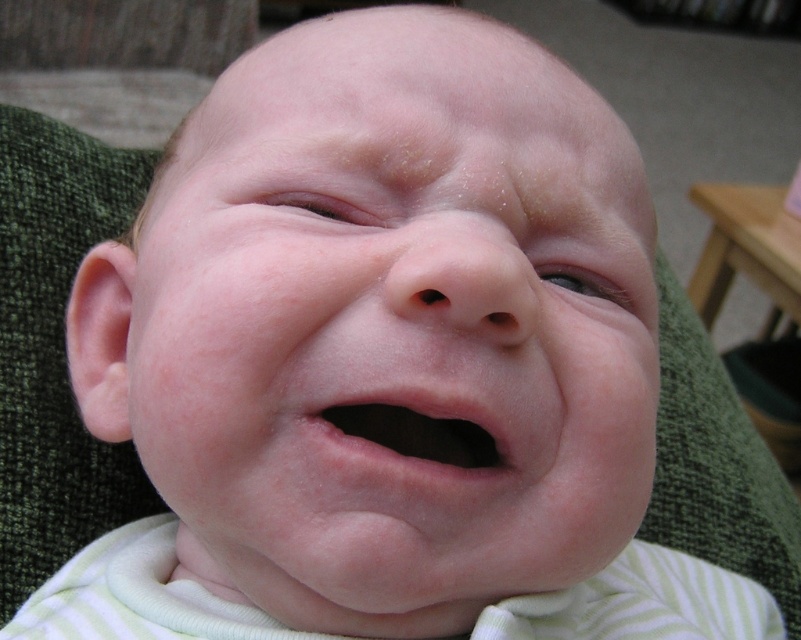
Does point (207, 221) come behind point (365, 438)?

That is True.

Which is more to the left, smooth skin face at center or pink smooth lips at center?

From the viewer's perspective, smooth skin face at center appears more on the left side.

You are a GUI agent. You are given a task and a screenshot of the screen. Output one action in this format:
    pyautogui.click(x=<x>, y=<y>)
    Task: Click on the smooth skin face at center
    This screenshot has height=640, width=801.
    Given the screenshot: What is the action you would take?
    pyautogui.click(x=393, y=324)

Find the location of a particular element. This screenshot has width=801, height=640. smooth skin face at center is located at coordinates (393, 324).